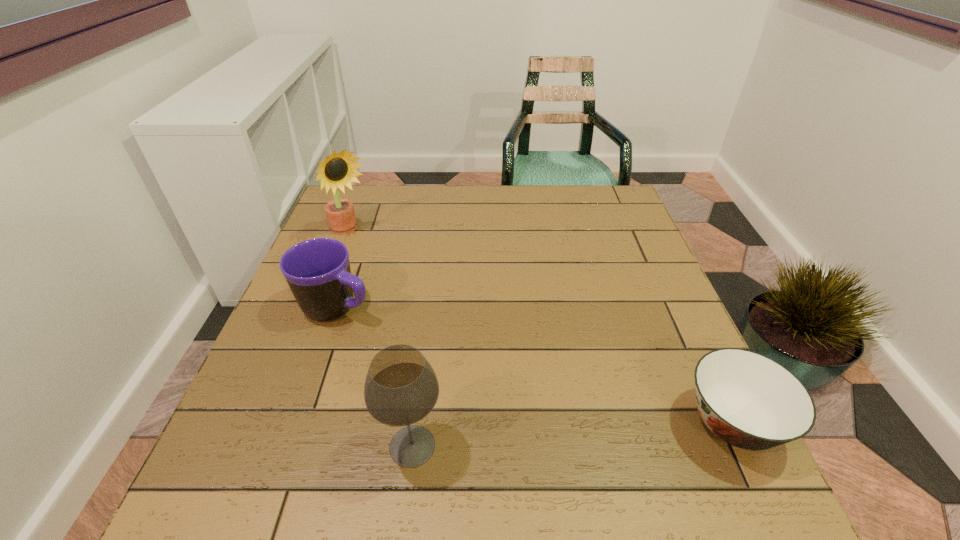
You are a GUI agent. You are given a task and a screenshot of the screen. Output one action in this format:
    pyautogui.click(x=<x>, y=<y>)
    Task: Click on the vacant area situated 0.380m on the face of the sunflower
    The height and width of the screenshot is (540, 960).
    Given the screenshot: What is the action you would take?
    pyautogui.click(x=442, y=324)

Where is `vacant space situated 0.180m on the face of the sunflower`? This screenshot has width=960, height=540. vacant space situated 0.180m on the face of the sunflower is located at coordinates (396, 278).

You are a GUI agent. You are given a task and a screenshot of the screen. Output one action in this format:
    pyautogui.click(x=<x>, y=<y>)
    Task: Click on the vacant space located 0.260m with the handle on the side of the third nearest object
    The height and width of the screenshot is (540, 960).
    Given the screenshot: What is the action you would take?
    pyautogui.click(x=468, y=363)

Where is `vacant area situated with the handle on the side of the third nearest object`? Image resolution: width=960 pixels, height=540 pixels. vacant area situated with the handle on the side of the third nearest object is located at coordinates (424, 342).

Locate an element on the screen. free location located 0.190m with the handle on the side of the third nearest object is located at coordinates (440, 349).

Locate an element on the screen. The height and width of the screenshot is (540, 960). object located at the far edge is located at coordinates 338,170.

Where is `wineglass positioned at the near edge`? Image resolution: width=960 pixels, height=540 pixels. wineglass positioned at the near edge is located at coordinates (401, 388).

Image resolution: width=960 pixels, height=540 pixels. What are the coordinates of `soup bowl located in the near edge section of the desktop` in the screenshot? It's located at (748, 400).

What are the coordinates of `sunflower present at the left edge` in the screenshot? It's located at (338, 170).

Locate an element on the screen. This screenshot has height=540, width=960. mug located at the left edge is located at coordinates (317, 270).